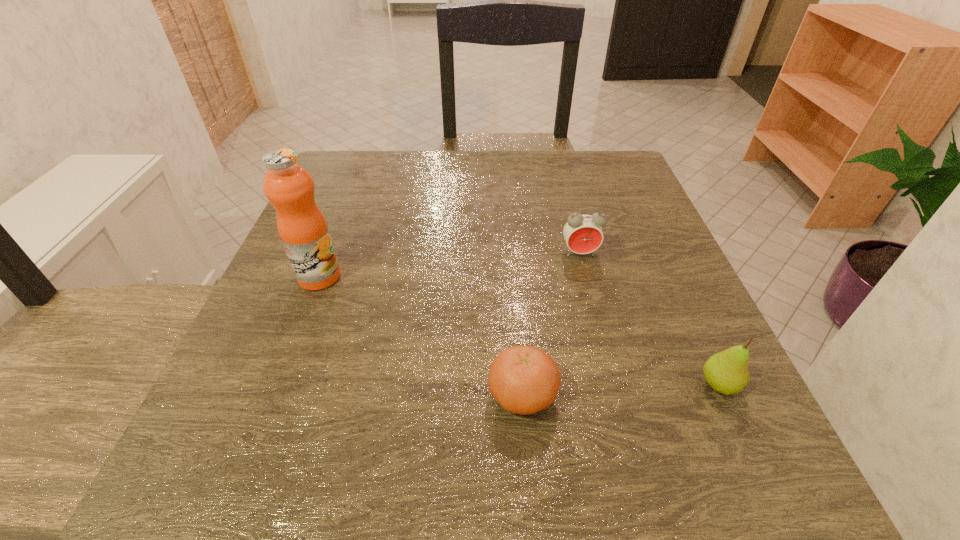
You are a GUI agent. You are given a task and a screenshot of the screen. Output one action in this format:
    pyautogui.click(x=<x>, y=<y>)
    Task: Click on the blank region between the leftmost object and the rightmost object
    The image size is (960, 540).
    Given the screenshot: What is the action you would take?
    pyautogui.click(x=519, y=331)

This screenshot has height=540, width=960. I want to click on free space between the leftmost object and the clementine, so click(x=420, y=336).

This screenshot has width=960, height=540. I want to click on free space between the fruit juice and the rightmost object, so click(x=519, y=331).

Identify the location of free space between the second object from right to left and the rightmost object. (649, 320).

The width and height of the screenshot is (960, 540). I want to click on vacant space that is in between the tallest object and the third object from left to right, so click(449, 265).

You are a GUI agent. You are given a task and a screenshot of the screen. Output one action in this format:
    pyautogui.click(x=<x>, y=<y>)
    Task: Click on the vacant area between the leftmost object and the pear
    
    Given the screenshot: What is the action you would take?
    pyautogui.click(x=519, y=331)

Find the location of a particular element. The height and width of the screenshot is (540, 960). vacant point located between the third object from right to left and the pear is located at coordinates (621, 390).

At what (x,y) coordinates should I click in order to perform the action: click on empty location between the alarm clock and the leftmost object. Please return your answer as a coordinate pair (x, y). The width and height of the screenshot is (960, 540). Looking at the image, I should click on (449, 265).

Find the location of a particular element. empty space between the rightmost object and the clementine is located at coordinates (621, 390).

At what (x,y) coordinates should I click in order to perform the action: click on empty space that is in between the clementine and the tallest object. Please return your answer as a coordinate pair (x, y). The width and height of the screenshot is (960, 540). Looking at the image, I should click on (420, 336).